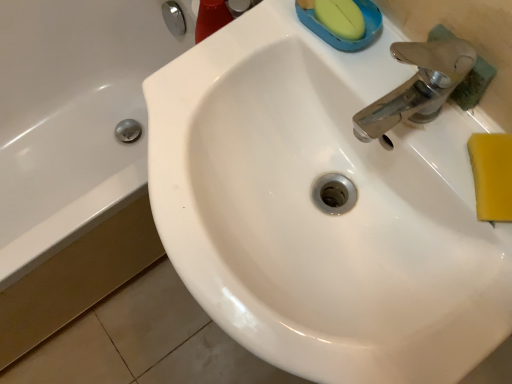
Question: Is white glossy bathtub at left bigger than white glossy sink at center?

Choices:
 (A) yes
 (B) no

Answer: (A)

Question: Could you tell me if white glossy bathtub at left is turned towards white glossy sink at center?

Choices:
 (A) no
 (B) yes

Answer: (B)

Question: Is white glossy bathtub at left placed right next to white glossy sink at center?

Choices:
 (A) yes
 (B) no

Answer: (B)

Question: From a real-world perspective, is white glossy bathtub at left physically above white glossy sink at center?

Choices:
 (A) no
 (B) yes

Answer: (A)

Question: Is white glossy bathtub at left wider than white glossy sink at center?

Choices:
 (A) no
 (B) yes

Answer: (B)

Question: Considering the positions of white glossy sink at center and white glossy bathtub at left in the image, is white glossy sink at center taller or shorter than white glossy bathtub at left?

Choices:
 (A) short
 (B) tall

Answer: (B)

Question: Is white glossy sink at center situated inside white glossy bathtub at left or outside?

Choices:
 (A) inside
 (B) outside

Answer: (B)

Question: From a real-world perspective, relative to white glossy bathtub at left, is white glossy sink at center vertically above or below?

Choices:
 (A) below
 (B) above

Answer: (B)

Question: From the image's perspective, is white glossy sink at center above or below white glossy bathtub at left?

Choices:
 (A) below
 (B) above

Answer: (A)

Question: Looking at their shapes, would you say white glossy sink at center is wider or thinner than yellow sponge at right?

Choices:
 (A) wide
 (B) thin

Answer: (A)

Question: Considering the positions of point (169, 71) and point (505, 170), is point (169, 71) closer or farther from the camera than point (505, 170)?

Choices:
 (A) farther
 (B) closer

Answer: (A)

Question: In terms of size, does white glossy sink at center appear bigger or smaller than yellow sponge at right?

Choices:
 (A) small
 (B) big

Answer: (B)

Question: Would you say white glossy sink at center is inside or outside yellow sponge at right?

Choices:
 (A) inside
 (B) outside

Answer: (B)

Question: Considering the positions of white glossy bathtub at left and white glossy sink at center in the image, is white glossy bathtub at left bigger or smaller than white glossy sink at center?

Choices:
 (A) big
 (B) small

Answer: (A)

Question: From the image's perspective, relative to white glossy sink at center, is white glossy bathtub at left above or below?

Choices:
 (A) above
 (B) below

Answer: (A)